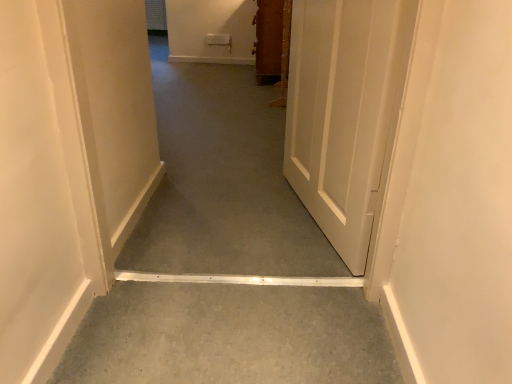
This screenshot has height=384, width=512. Describe the element at coordinates (345, 111) in the screenshot. I see `white wood door at center` at that location.

What is the approximate height of white wood door at center?

white wood door at center is 31.51 inches tall.

Locate an element on the screen. white wood door at center is located at coordinates (345, 111).

Identify the location of white wood door at center. pos(345,111).